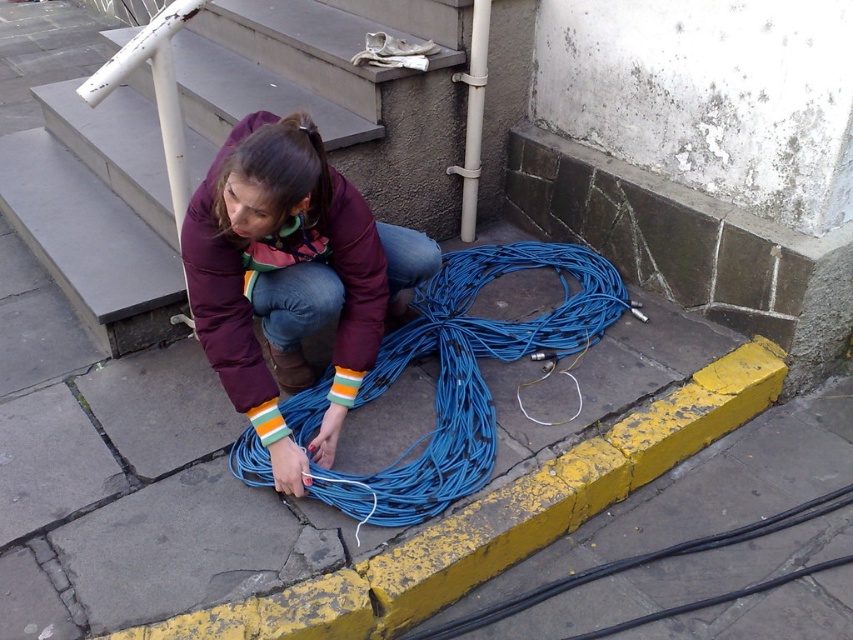
You are standing at the bottom of the concrete stairs at center. Which direction should you move to reach the point labeled as point (97,209)?

The point (97,209) corresponds to the concrete stairs at center, so you are already at that location.

You are standing at the base of the steps and want to reach the top. There are two points marked on the steps. Which point is closer to you, point (140, 237) or point (444, 464)?

Point (140, 237) is closer to you because it is further to the camera, meaning it is physically nearer to your current position at the base of the steps.